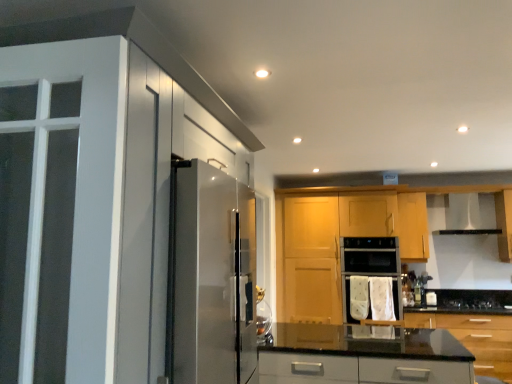
Question: Based on their positions, is white glossy cabinet at left, positioned as the 1th cabinetry in left-to-right order, located to the left or right of black glass gas stove at lower center?

Choices:
 (A) right
 (B) left

Answer: (B)

Question: From a real-world perspective, relative to black glass gas stove at lower center, is white glossy cabinet at left, acting as the fourth cabinetry starting from the right, vertically above or below?

Choices:
 (A) above
 (B) below

Answer: (A)

Question: Based on their relative distances, which object is farther from the satin silver exhaust hood at upper right?

Choices:
 (A) satin silver screen door at left
 (B) glossy wood cabinets at center, which is the second cabinetry in left-to-right order
 (C) white glossy cabinet at left, positioned as the 1th cabinetry in left-to-right order
 (D) white fabric oven at center
 (E) black glossy countertop at lower right, the 1th cabinetry positioned from the right

Answer: (C)

Question: Estimate the real-world distances between objects in this image. Which object is farther from the black glass gas stove at lower center?

Choices:
 (A) satin silver screen door at left
 (B) black glossy countertop at lower right, which is the 4th cabinetry from left to right
 (C) white fabric oven at center
 (D) glossy wood cabinets at center, which is the second cabinetry in left-to-right order
 (E) wooden cabinet at center, which appears as the second cabinetry when viewed from the right

Answer: (A)